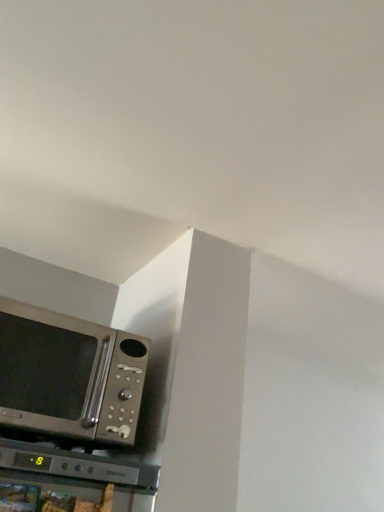
Question: Should I look upward or downward to see metallic silver microwave at lower left?

Choices:
 (A) down
 (B) up

Answer: (A)